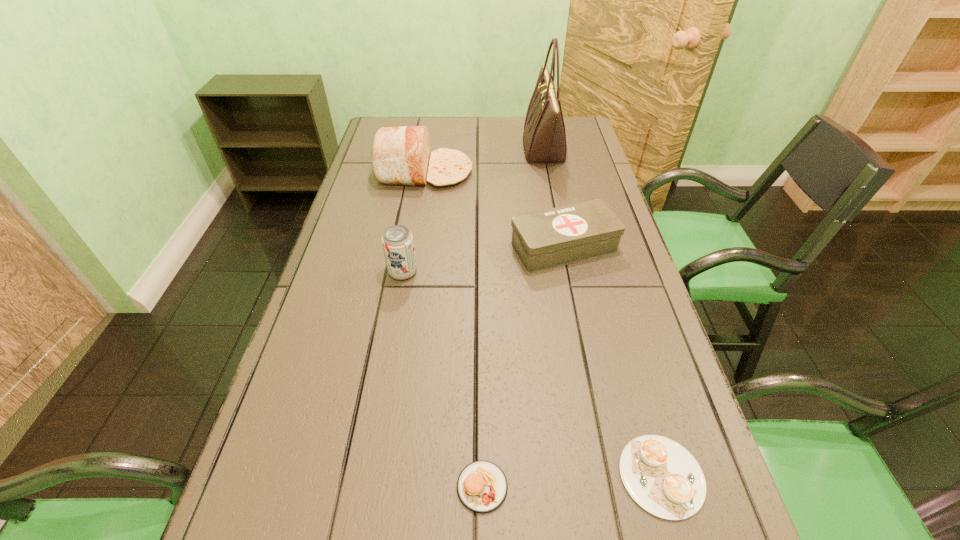
I want to click on handbag, so click(x=544, y=138).

Where is `bread`? This screenshot has width=960, height=540. bread is located at coordinates (400, 155).

Where is `beer can`? This screenshot has width=960, height=540. beer can is located at coordinates (397, 241).

Locate an element on the screen. Image resolution: width=960 pixels, height=540 pixels. the third shortest object is located at coordinates 544,239.

Find the location of a particular element. the second shortest object is located at coordinates (482, 486).

Where is `cappuccino`? This screenshot has height=540, width=960. cappuccino is located at coordinates (662, 477).

Locate an element on the screen. This screenshot has width=960, height=540. free region located 0.210m on the front-facing side of the handbag is located at coordinates (463, 148).

This screenshot has height=540, width=960. In order to click on vacant region located 0.170m on the front-facing side of the handbag in this screenshot , I will do `click(474, 148)`.

Image resolution: width=960 pixels, height=540 pixels. Identify the location of vacant space located 0.200m on the front-facing side of the handbag. (466, 148).

Locate an element on the screen. The image size is (960, 540). vacant space located at the sliced end of the bread is located at coordinates (507, 172).